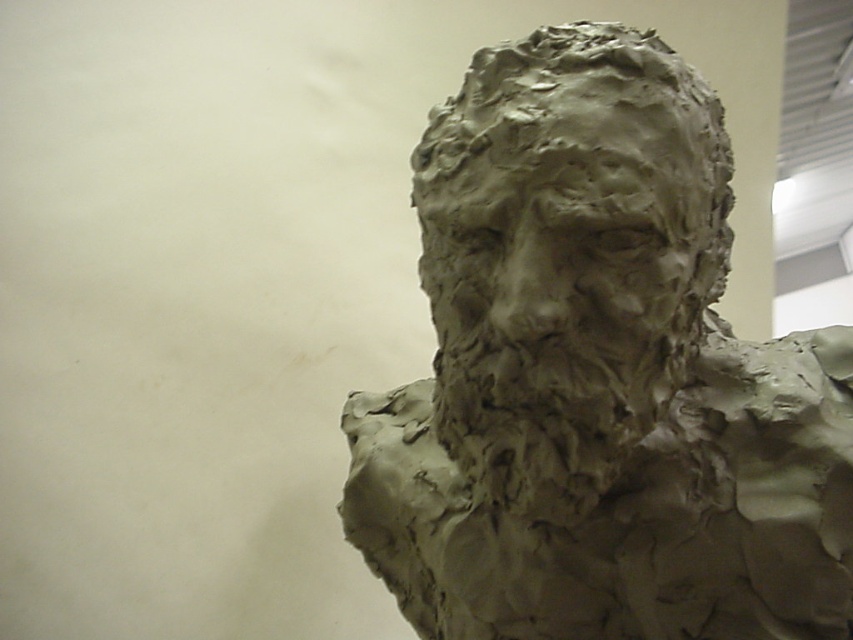
Question: Can you confirm if gray clay bust at center is positioned to the left of clay sculpture at center?

Choices:
 (A) no
 (B) yes

Answer: (A)

Question: Which object is farther from the camera taking this photo?

Choices:
 (A) clay sculpture at center
 (B) gray clay bust at center

Answer: (B)

Question: Is gray clay bust at center to the left of clay sculpture at center from the viewer's perspective?

Choices:
 (A) yes
 (B) no

Answer: (B)

Question: Considering the relative positions of gray clay bust at center and clay sculpture at center in the image provided, where is gray clay bust at center located with respect to clay sculpture at center?

Choices:
 (A) above
 (B) below

Answer: (B)

Question: Which object is farther from the camera taking this photo?

Choices:
 (A) gray clay bust at center
 (B) clay sculpture at center

Answer: (A)